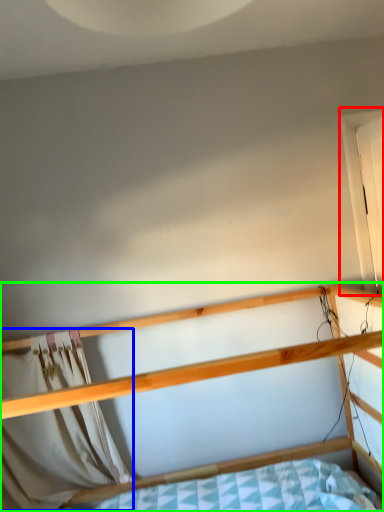
Question: Which is farther away from window (highlighted by a red box)? curtain (highlighted by a blue box) or bed (highlighted by a green box)?

Choices:
 (A) curtain
 (B) bed

Answer: (A)